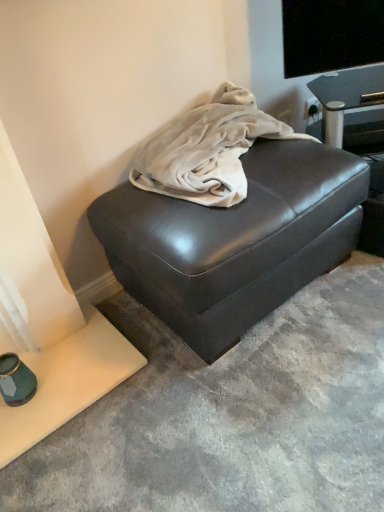
You are a GUI agent. You are given a task and a screenshot of the screen. Output one action in this format:
    pyautogui.click(x=<x>, y=<y>)
    Task: Click on the shiny dark brown leather ottoman at center
    
    Given the screenshot: What is the action you would take?
    pyautogui.click(x=235, y=241)

The width and height of the screenshot is (384, 512). Describe the element at coordinates (235, 241) in the screenshot. I see `shiny dark brown leather ottoman at center` at that location.

Where is `shiny dark brown leather ottoman at center`? shiny dark brown leather ottoman at center is located at coordinates (235, 241).